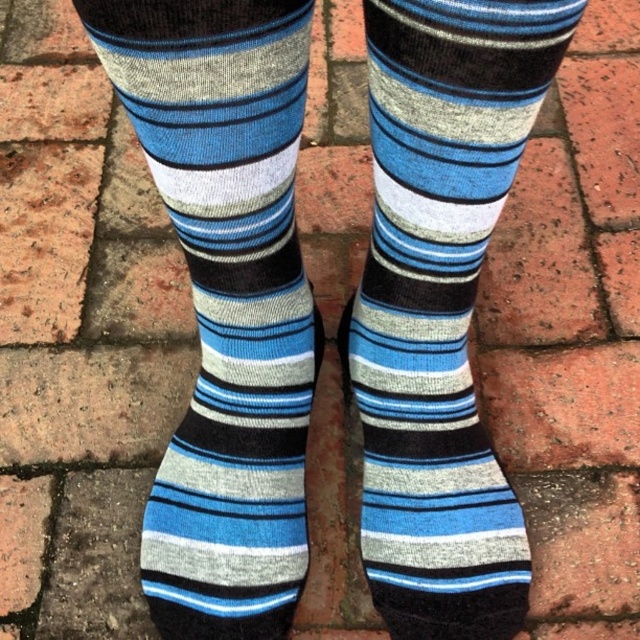
Question: Is blue striped sock at left above blue striped sock at center?

Choices:
 (A) no
 (B) yes

Answer: (B)

Question: Which object is farther from the camera taking this photo?

Choices:
 (A) blue striped sock at left
 (B) blue striped sock at center

Answer: (A)

Question: Can you confirm if blue striped sock at left is wider than blue striped sock at center?

Choices:
 (A) yes
 (B) no

Answer: (B)

Question: Is blue striped sock at left below blue striped sock at center?

Choices:
 (A) no
 (B) yes

Answer: (A)